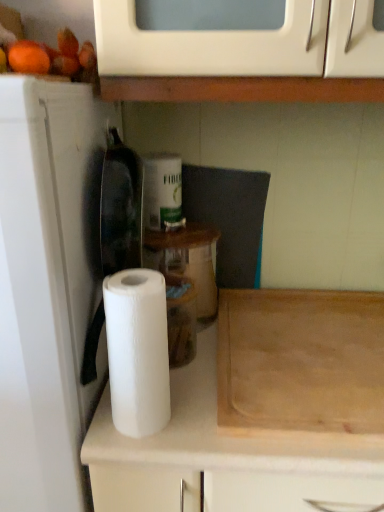
Identify the location of vacant area to the right of white matte paper towel at center. The width and height of the screenshot is (384, 512). (203, 421).